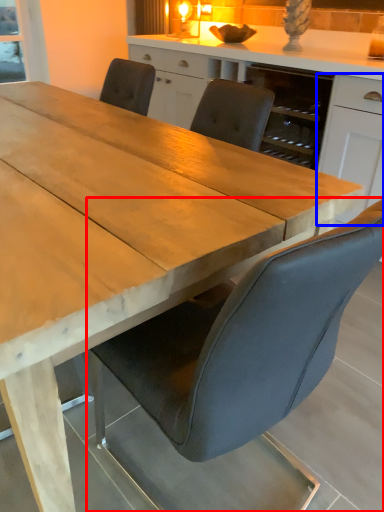
Question: Which object appears farthest to the camera in this image, chair (highlighted by a red box) or cabinetry (highlighted by a blue box)?

Choices:
 (A) chair
 (B) cabinetry

Answer: (B)